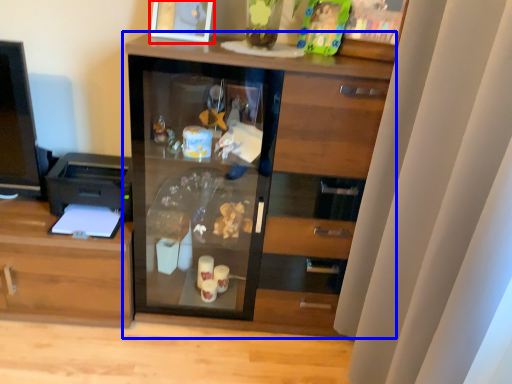
Question: Which of the following is the closest to the observer, picture frame (highlighted by a red box) or cupboard (highlighted by a blue box)?

Choices:
 (A) picture frame
 (B) cupboard

Answer: (B)